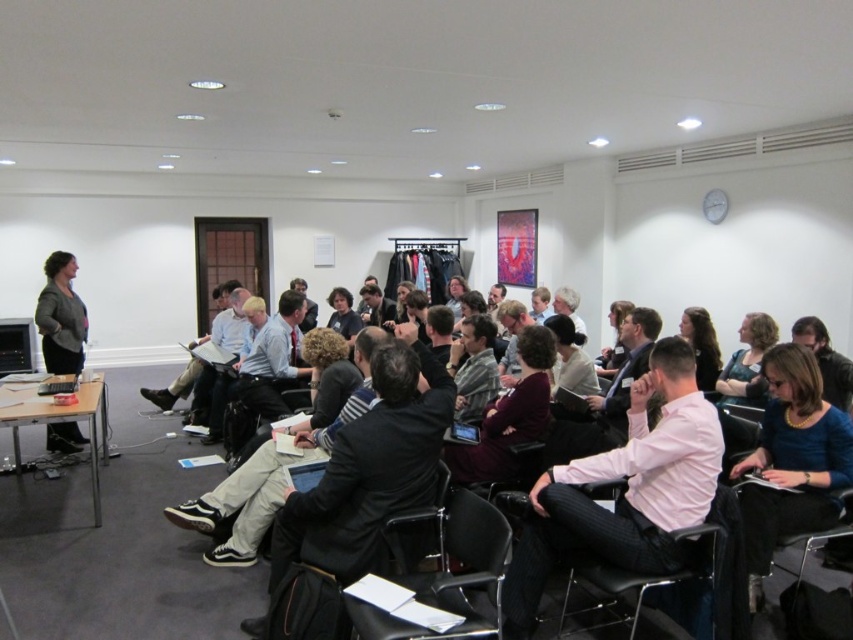
Question: Among these objects, which one is farthest from the camera?

Choices:
 (A) dark gray suit at center
 (B) black leather chair at lower center
 (C) pink shirt at center

Answer: (A)

Question: Which is nearer to the black leather chair at lower center?

Choices:
 (A) matte gray blazer at left
 (B) pink shirt at center
 (C) black leather chair at center
 (D) dark brown leather jacket at center

Answer: (B)

Question: Can you confirm if dark brown leather jacket at center is wider than black leather chair at center?

Choices:
 (A) no
 (B) yes

Answer: (B)

Question: Among these points, which one is farthest from the camera?

Choices:
 (A) (651, 596)
 (B) (550, 451)

Answer: (B)

Question: Is dark gray suit at center bigger than black leather chair at lower center?

Choices:
 (A) no
 (B) yes

Answer: (B)

Question: Can you confirm if dark gray suit at center is wider than black leather chair at center?

Choices:
 (A) no
 (B) yes

Answer: (B)